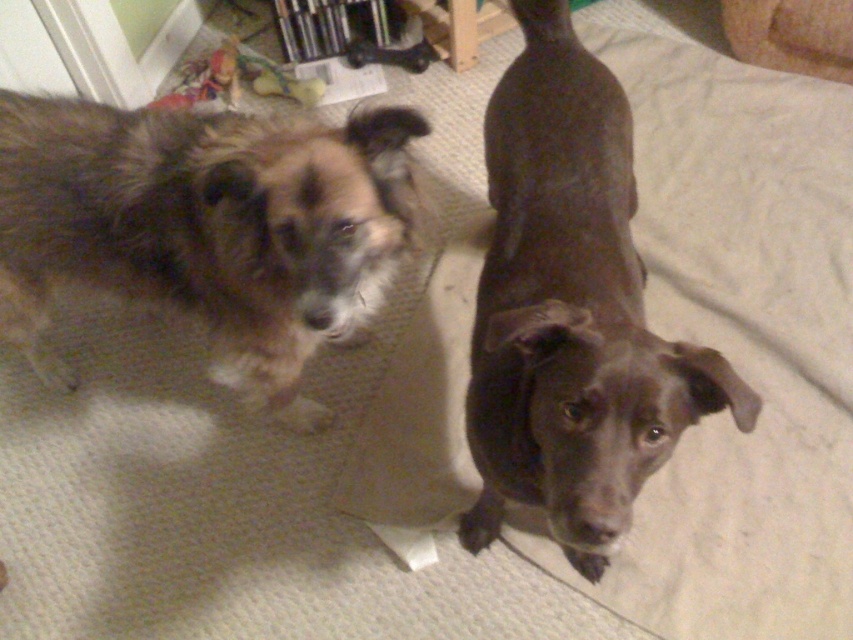
Question: Which point appears farthest from the camera in this image?

Choices:
 (A) (287, 202)
 (B) (650, 465)

Answer: (A)

Question: Among these objects, which one is nearest to the camera?

Choices:
 (A) brown fuzzy dog at left
 (B) shiny brown dog at center

Answer: (B)

Question: Does brown fuzzy dog at left have a greater width compared to shiny brown dog at center?

Choices:
 (A) yes
 (B) no

Answer: (A)

Question: Which of the following is the farthest from the observer?

Choices:
 (A) (300, 358)
 (B) (578, 61)

Answer: (B)

Question: Does brown fuzzy dog at left have a greater width compared to shiny brown dog at center?

Choices:
 (A) no
 (B) yes

Answer: (B)

Question: Does brown fuzzy dog at left have a larger size compared to shiny brown dog at center?

Choices:
 (A) yes
 (B) no

Answer: (A)